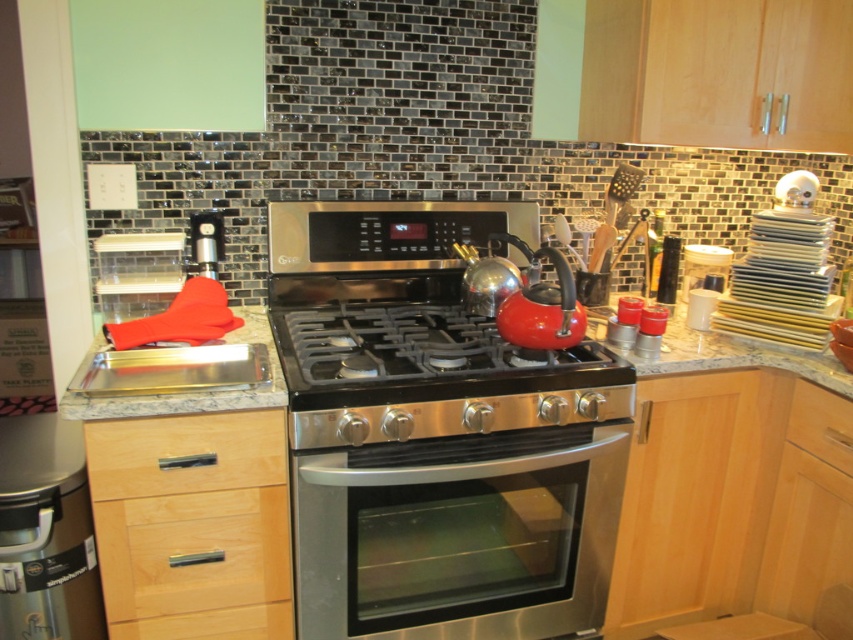
You are a chef preparing to place a large pot on the black matte gas stove at center. Considering the height of the stove compared to the granite countertop at center, will the pot be more stable on the stove or the countertop?

The black matte gas stove at center is much taller than the granite countertop at center, so placing the large pot on the stove may make it less stable due to the height difference. It would be more stable on the granite countertop at center which is lower and provides a more secure base.

In the modern kitchen scene, there is a stainless steel oven at center and a granite countertop at center. Which object is positioned to the left of the other?

The stainless steel oven at center is to the left of granite countertop at center.